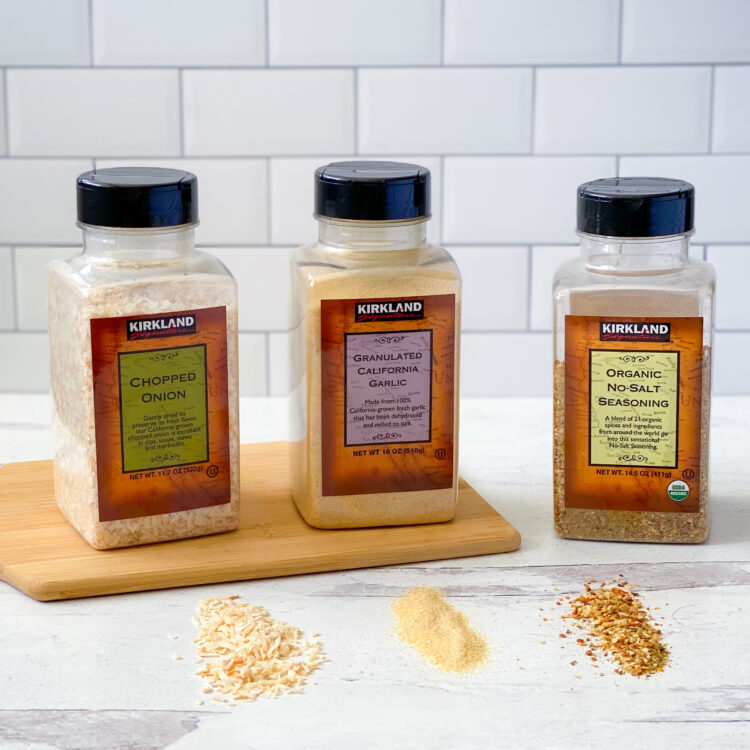
Where is `marble countertop`? The image size is (750, 750). marble countertop is located at coordinates (712, 642).